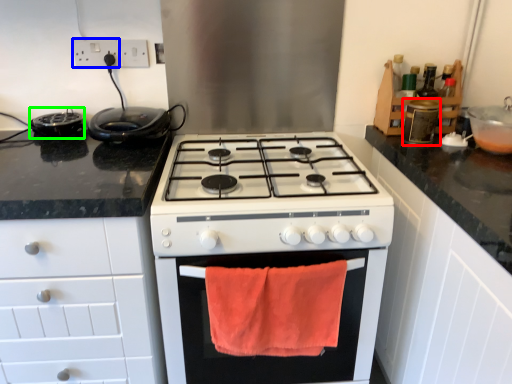
Question: Estimate the real-world distances between objects in this image. Which object is closer to appliance (highlighted by a red box), electric outlet (highlighted by a blue box) or appliance (highlighted by a green box)?

Choices:
 (A) electric outlet
 (B) appliance

Answer: (A)